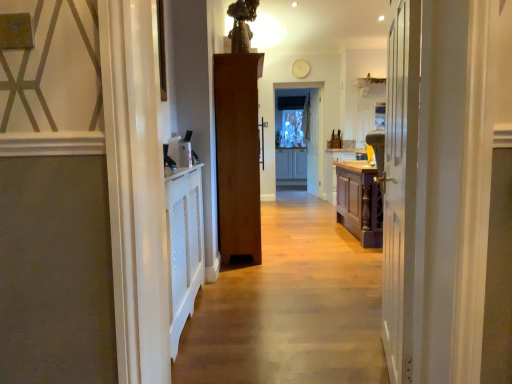
Locate an element on the screen. unoccupied region to the right of brown wooden door at center, marked as the third door in a right-to-left arrangement is located at coordinates (310, 248).